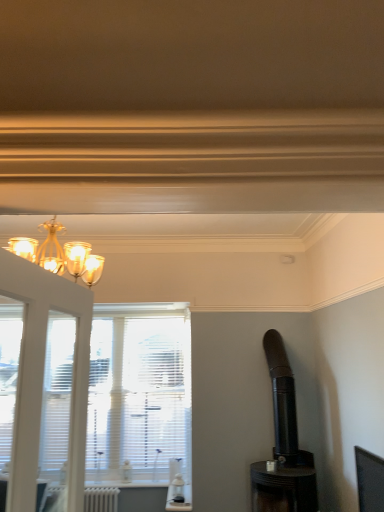
Identify the location of white matte radiator at lower left. This screenshot has height=512, width=384. (101, 499).

What do you see at coordinates (101, 499) in the screenshot?
I see `white matte radiator at lower left` at bounding box center [101, 499].

Measure the distance between point [95,495] and camera.

The distance of point [95,495] from camera is 4.11 meters.

Measure the distance between white matte radiator at lower left and camera.

white matte radiator at lower left is 12.45 feet from camera.

This screenshot has width=384, height=512. What are the coordinates of `black matte stove at right` in the screenshot? It's located at (283, 445).

What do you see at coordinates (283, 445) in the screenshot?
I see `black matte stove at right` at bounding box center [283, 445].

The height and width of the screenshot is (512, 384). I want to click on white matte radiator at lower left, so click(101, 499).

Does black matte stove at right appear on the right side of white matte radiator at lower left?

Yes.

Consider the image. In the image, is black matte stove at right positioned in front of or behind white matte radiator at lower left?

Visually, black matte stove at right is located in front of white matte radiator at lower left.

Is point (264, 350) positioned after point (107, 487)?

That is False.

From the image's perspective, relative to white matte radiator at lower left, is black matte stove at right above or below?

black matte stove at right is situated higher than white matte radiator at lower left in the image.

From a real-world perspective, is black matte stove at right located beneath white matte radiator at lower left?

Incorrect, from a real-world perspective, black matte stove at right is higher than white matte radiator at lower left.

Is black matte stove at right wider than white matte radiator at lower left?

Correct, the width of black matte stove at right exceeds that of white matte radiator at lower left.

Is black matte stove at right shorter than white matte radiator at lower left?

Incorrect, the height of black matte stove at right does not fall short of that of white matte radiator at lower left.

Which of these two, black matte stove at right or white matte radiator at lower left, is bigger?

Bigger between the two is black matte stove at right.

Is black matte stove at right not within white matte radiator at lower left?

Absolutely, black matte stove at right is external to white matte radiator at lower left.

Would you say black matte stove at right is a long distance from white matte radiator at lower left?

That's right, there is a large distance between black matte stove at right and white matte radiator at lower left.

Is black matte stove at right positioned with its back to white matte radiator at lower left?

No.

How different are the orientations of black matte stove at right and white matte radiator at lower left in degrees?

The angle between the facing direction of black matte stove at right and the facing direction of white matte radiator at lower left is 89.3 degrees.

Locate an element on the screen. Image resolution: width=384 pixels, height=512 pixels. appliance that appears in front of the white matte radiator at lower left is located at coordinates (283, 445).

Visually, is white matte radiator at lower left positioned to the left or to the right of black matte stove at right?

From the image, it's evident that white matte radiator at lower left is to the left of black matte stove at right.

Which object is further away from the camera taking this photo, white matte radiator at lower left or black matte stove at right?

white matte radiator at lower left is behind.

Is point (92, 488) positioned behind point (281, 348)?

Yes.

From the image's perspective, is white matte radiator at lower left under black matte stove at right?

Yes, from the image's perspective, white matte radiator at lower left is below black matte stove at right.

From a real-world perspective, which is physically below, white matte radiator at lower left or black matte stove at right?

white matte radiator at lower left, from a real-world perspective.

Between white matte radiator at lower left and black matte stove at right, which one has smaller width?

white matte radiator at lower left.

Considering the sizes of objects white matte radiator at lower left and black matte stove at right in the image provided, who is shorter, white matte radiator at lower left or black matte stove at right?

With less height is white matte radiator at lower left.

Does white matte radiator at lower left have a smaller size compared to black matte stove at right?

Yes.

Choose the correct answer: Is white matte radiator at lower left inside black matte stove at right or outside it?

white matte radiator at lower left is not inside black matte stove at right, it's outside.

Is white matte radiator at lower left placed right next to black matte stove at right?

white matte radiator at lower left and black matte stove at right are not in contact.

Is black matte stove at right at the back of white matte radiator at lower left?

No, white matte radiator at lower left is not facing away from black matte stove at right.

How many degrees apart are the facing directions of white matte radiator at lower left and black matte stove at right?

The angular difference between white matte radiator at lower left and black matte stove at right is 89.3 degrees.

How much distance is there between white matte radiator at lower left and black matte stove at right?

white matte radiator at lower left is 1.89 meters from black matte stove at right.

Find the location of a particular element. Image resolution: width=384 pixels, height=512 pixels. radiator below the black matte stove at right (from a real-world perspective) is located at coordinates (101, 499).

The image size is (384, 512). Identify the location of appliance lying on the right of white matte radiator at lower left. (283, 445).

I want to click on appliance located above the white matte radiator at lower left (from a real-world perspective), so click(283, 445).